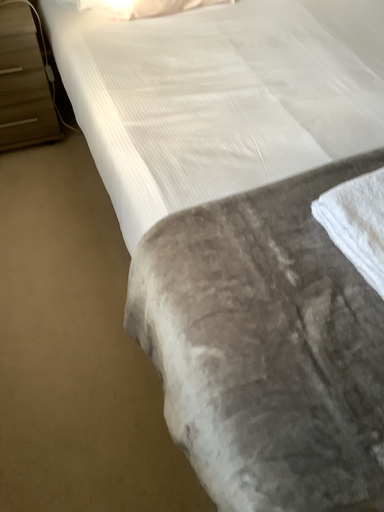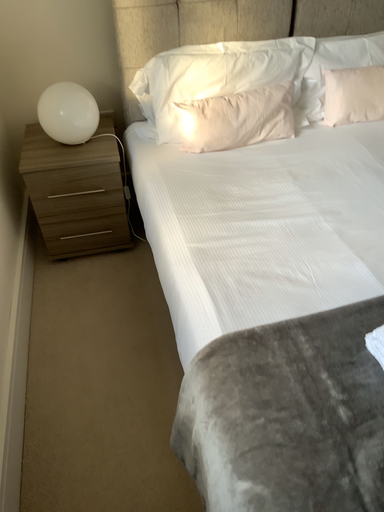
Question: How did the camera likely rotate when shooting the video?

Choices:
 (A) rotated upward
 (B) rotated downward

Answer: (A)